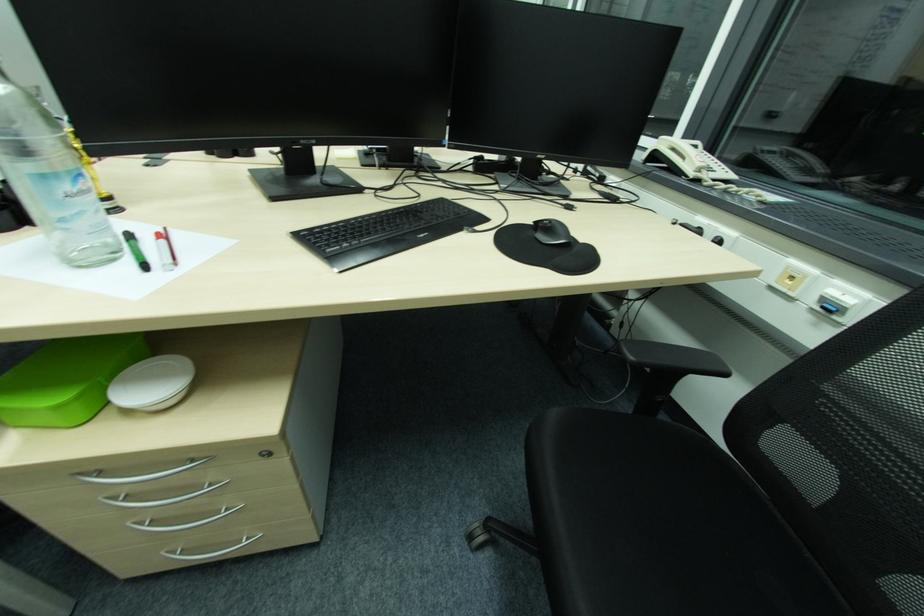
Describe the element at coordinates (672, 358) in the screenshot. Image resolution: width=924 pixels, height=616 pixels. I see `a black chair armrest` at that location.